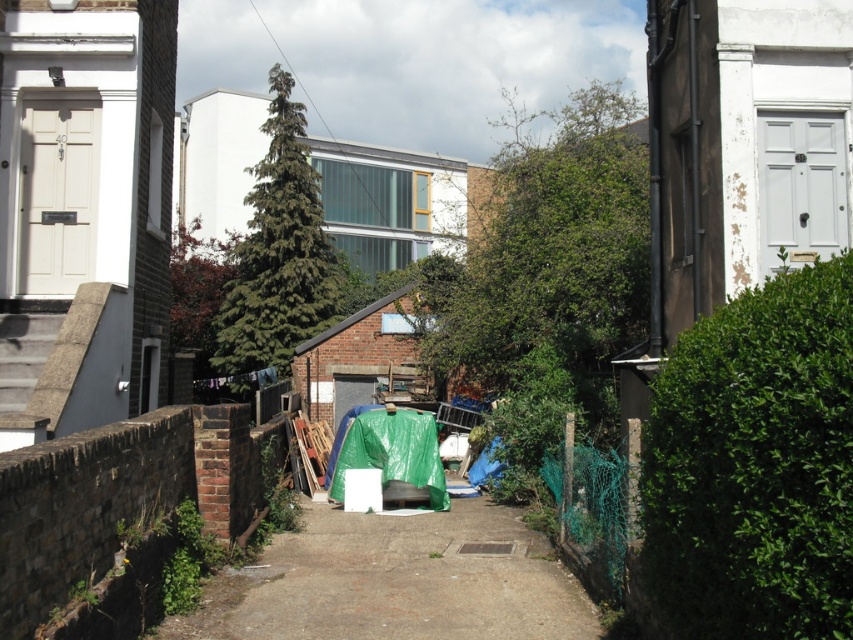
You are a delivery person trying to navigate through the narrow alleyway. You see the green leafy hedge at right and the dull concrete path at center. Which of these two objects is narrower?

The green leafy hedge at right is thinner than the dull concrete path at center, so the green leafy hedge at right is narrower.

You are a delivery person trying to navigate through the narrow alleyway between the two residential buildings. You need to deliver a package to the door marked 40 on the left wall. As you approach the green leafy hedge at center, where will you find the dull concrete path at center?

The dull concrete path at center is located below the green leafy hedge at center, so you will find it underneath the hedge.

You are a delivery person trying to navigate through the alley. You see a green leafy hedge at right and a green leafy hedge at center. Which hedge is closer to the ground?

The green leafy hedge at right is located below the green leafy hedge at center, so it is closer to the ground.